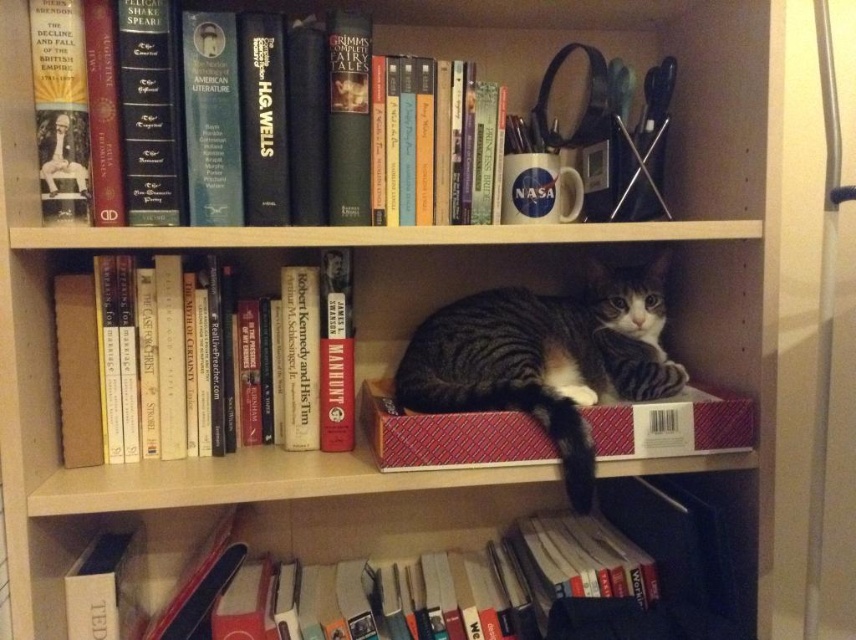
Question: In this image, where is red textured box at center located relative to hardcover book at upper left?

Choices:
 (A) above
 (B) below

Answer: (B)

Question: Does red textured box at center have a smaller size compared to hardcover book at upper left?

Choices:
 (A) yes
 (B) no

Answer: (A)

Question: Can you confirm if striped fur cat at center is positioned to the left of red textured box at center?

Choices:
 (A) no
 (B) yes

Answer: (A)

Question: Among these objects, which one is nearest to the camera?

Choices:
 (A) red textured box at center
 (B) striped fur cat at center
 (C) hardcover book at center

Answer: (A)

Question: Which object is closer to the camera taking this photo?

Choices:
 (A) red textured box at center
 (B) hardcover book at center

Answer: (A)

Question: Which of the following is the closest to the observer?

Choices:
 (A) (108, 356)
 (B) (521, 307)

Answer: (A)